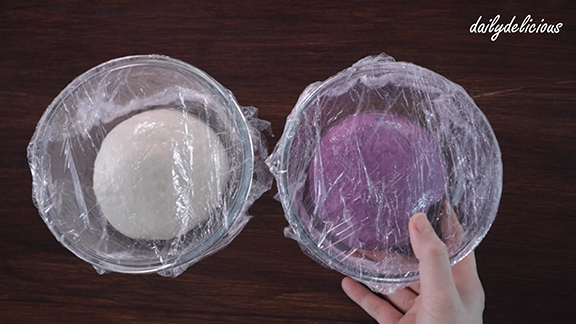
This screenshot has height=324, width=576. I want to click on bowls, so click(190, 148), click(357, 164).